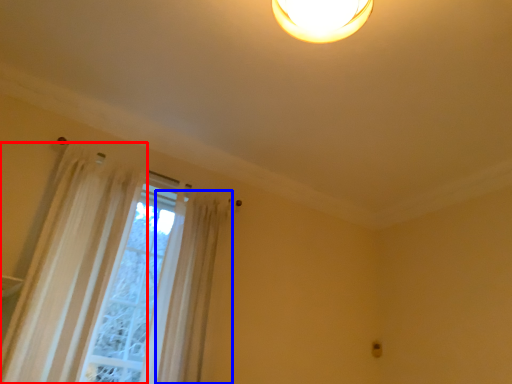
Question: Which of the following is the closest to the observer, curtain (highlighted by a red box) or shower curtain (highlighted by a blue box)?

Choices:
 (A) curtain
 (B) shower curtain

Answer: (A)